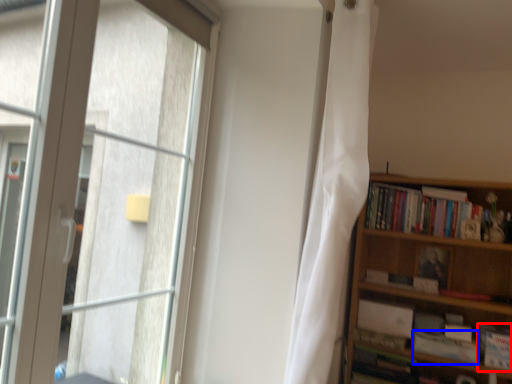
Question: Which point is closer to the camera, book (highlighted by a red box) or paperback book (highlighted by a blue box)?

Choices:
 (A) book
 (B) paperback book

Answer: (A)